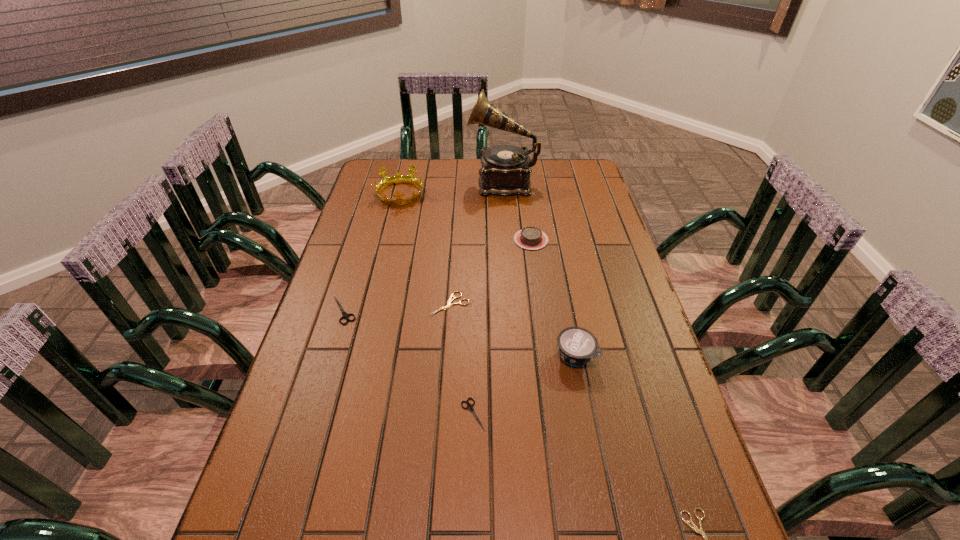
This screenshot has width=960, height=540. Find the location of `the bigger beige shears`. the bigger beige shears is located at coordinates (450, 300).

Locate an element on the screen. The height and width of the screenshot is (540, 960). the nearer black shears is located at coordinates (469, 406).

Locate an element on the screen. the second nearest shears is located at coordinates (469, 406).

Identify the location of free region located 0.120m on the horn of the phonograph record. (438, 181).

I want to click on vacant area situated 0.130m on the horn of the phonograph record, so click(x=435, y=181).

Image resolution: width=960 pixels, height=540 pixels. What are the coordinates of `free location located 0.150m on the horn of the phonograph record` in the screenshot? It's located at pos(430,181).

Locate an element on the screen. The width and height of the screenshot is (960, 540). vacant region located 0.320m on the front of the crown is located at coordinates (383, 267).

Find the location of `vacant space located 0.190m on the back of the third nearest object`. vacant space located 0.190m on the back of the third nearest object is located at coordinates (563, 291).

Find the location of a particular element. vacant region located on the left of the chocolate cake is located at coordinates (407, 240).

This screenshot has height=540, width=960. What are the coordinates of `vacant space located 0.350m on the front of the fourth shortest object` in the screenshot? It's located at (301, 448).